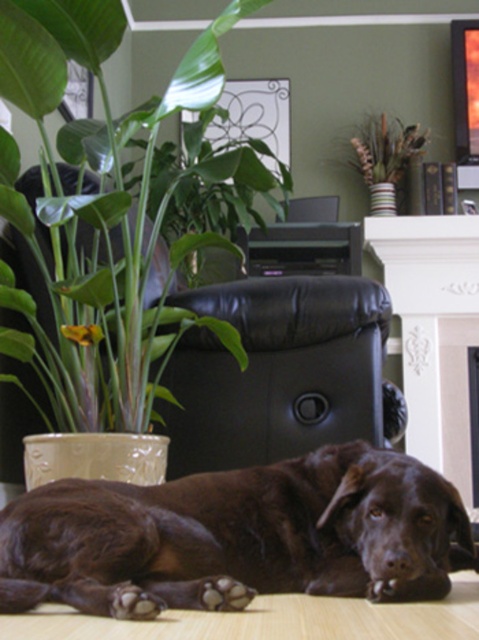
Is brown furry dog at lower center further to the viewer compared to white painted wood fireplace at upper center?

No, it is not.

Who is more distant from viewer, (277, 550) or (445, 465)?

The point (445, 465) is more distant.

Find the location of `brown furry dog at lower center`. brown furry dog at lower center is located at coordinates (238, 536).

The width and height of the screenshot is (479, 640). What do you see at coordinates (238, 536) in the screenshot?
I see `brown furry dog at lower center` at bounding box center [238, 536].

Between brown furry dog at lower center and green leafy plant at left, which one has more height?

green leafy plant at left is taller.

Measure the distance between brown furry dog at lower center and camera.

brown furry dog at lower center and camera are 4.00 feet apart.

Where is `brown furry dog at lower center`? The width and height of the screenshot is (479, 640). brown furry dog at lower center is located at coordinates (238, 536).

Is green leafy plant at left below white painted wood fireplace at upper center?

Incorrect, green leafy plant at left is not positioned below white painted wood fireplace at upper center.

Which is behind, point (92, 307) or point (409, 262)?

Positioned behind is point (409, 262).

This screenshot has height=640, width=479. I want to click on green leafy plant at left, so click(102, 211).